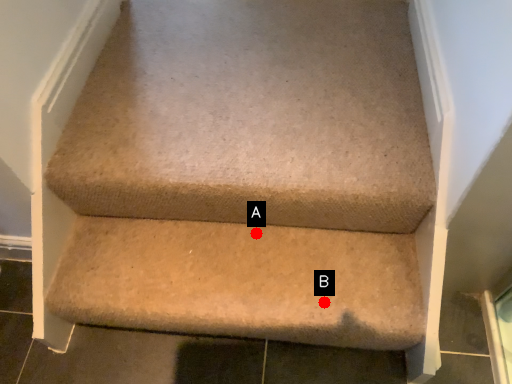
Question: Two points are circled on the image, labeled by A and B beside each circle. Which point appears closest to the camera in this image?

Choices:
 (A) A is closer
 (B) B is closer

Answer: (B)